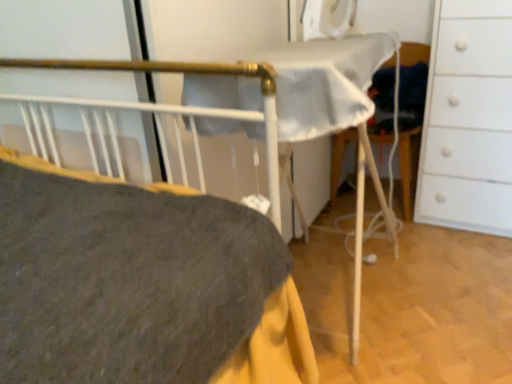
Find the location of `vacant area in front of white matte chest of drawers at right`. vacant area in front of white matte chest of drawers at right is located at coordinates (461, 254).